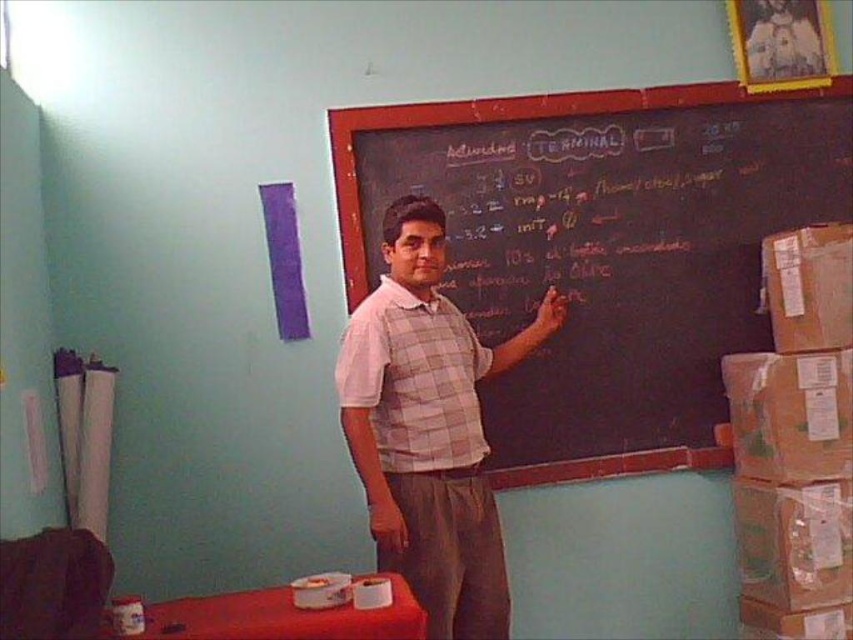
Measure the distance between black chalkboard at upper center and plaid fabric vest at center.

A distance of 19.69 inches exists between black chalkboard at upper center and plaid fabric vest at center.

Is point (747, 122) in front of point (386, 243)?

No.

Where is `black chalkboard at upper center`? black chalkboard at upper center is located at coordinates (602, 248).